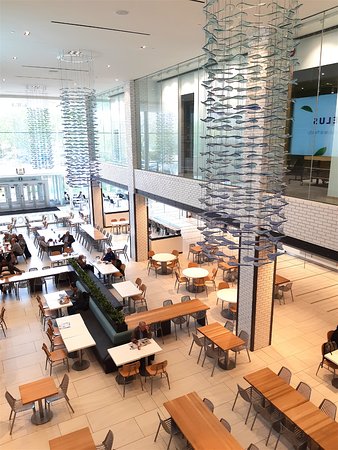
I want to click on doors, so click(2, 199), click(14, 198), click(27, 197), click(39, 195).